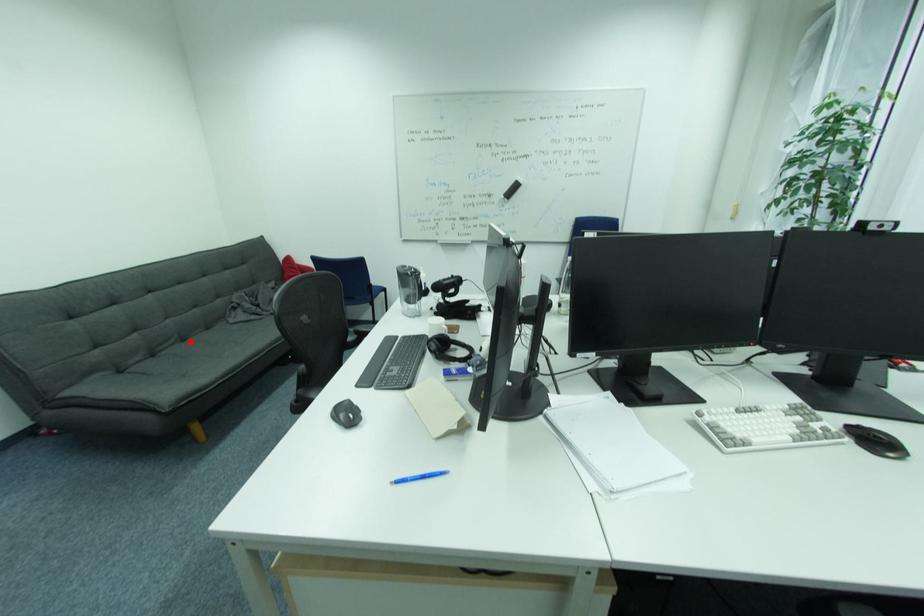
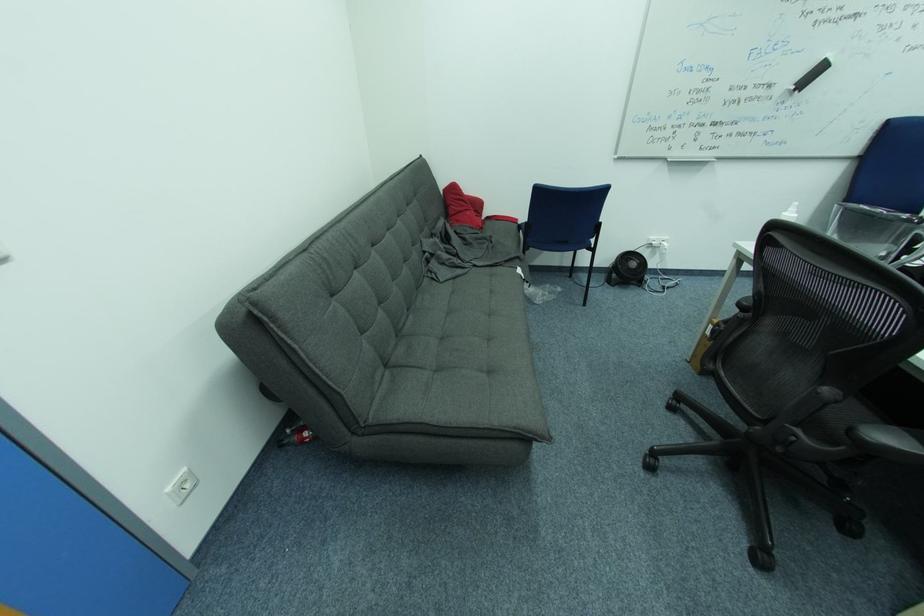
Locate, in the second image, the point that corresponds to the highlighted location in the first image.

(415, 312)